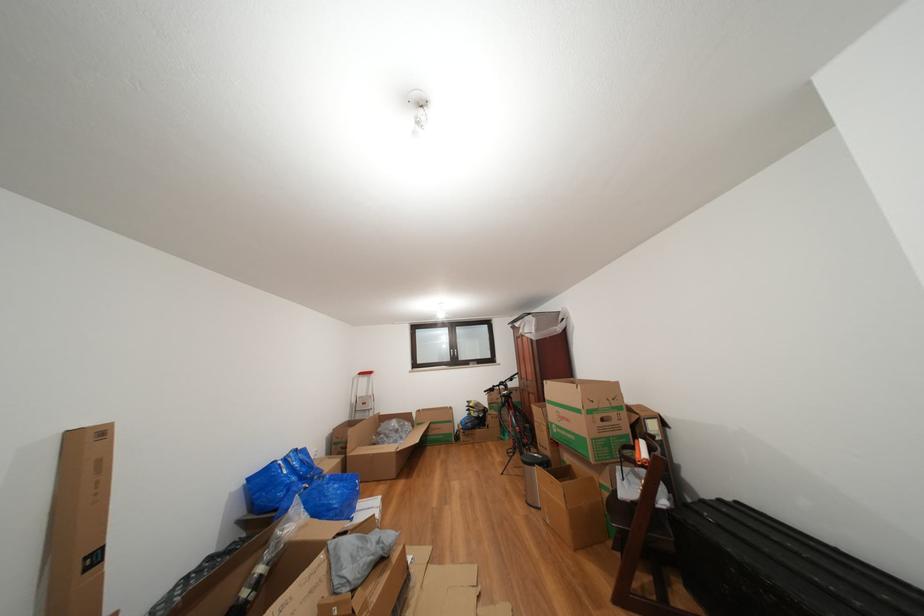
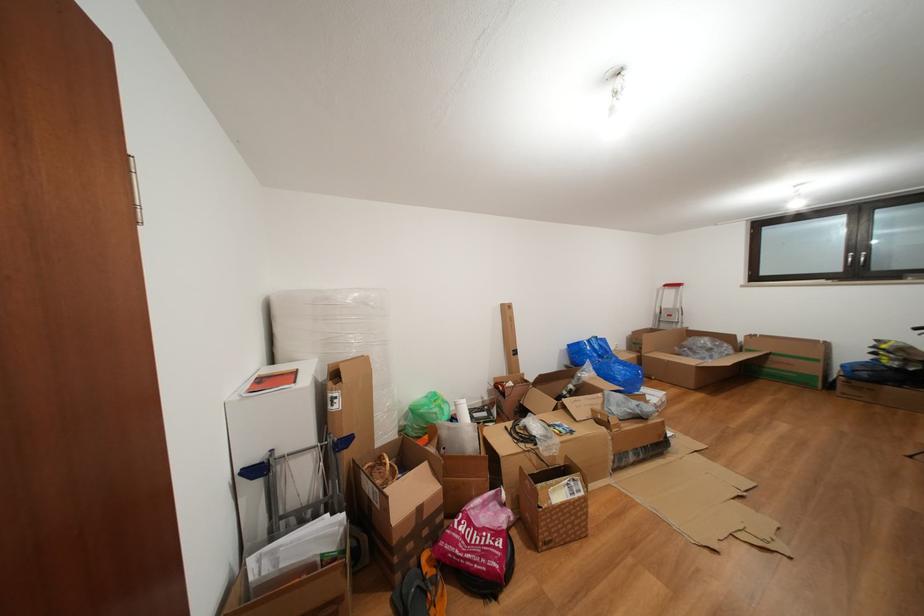
Locate, in the second image, the point that corresponds to point (294, 464) in the first image.

(597, 346)